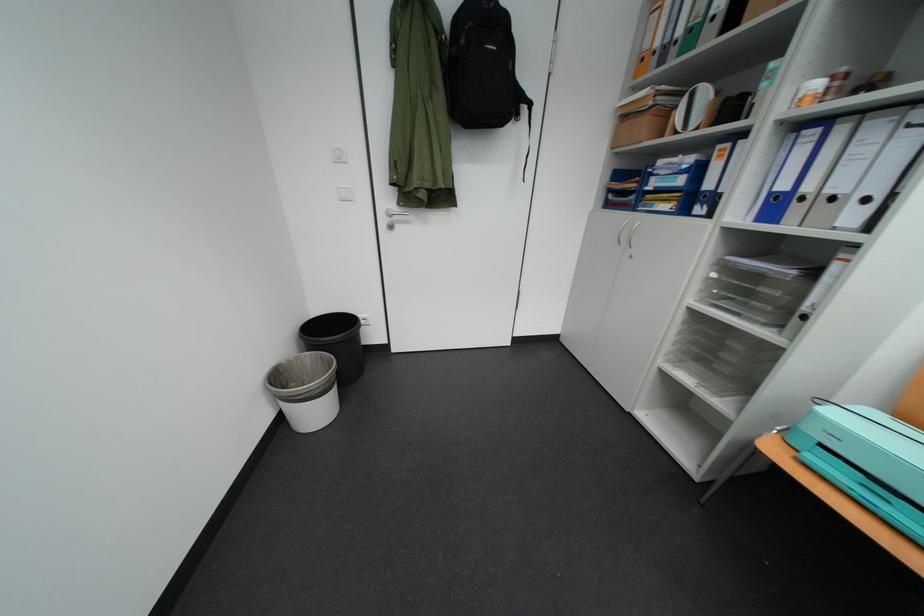
The height and width of the screenshot is (616, 924). What do you see at coordinates (482, 68) in the screenshot?
I see `the black backpack` at bounding box center [482, 68].